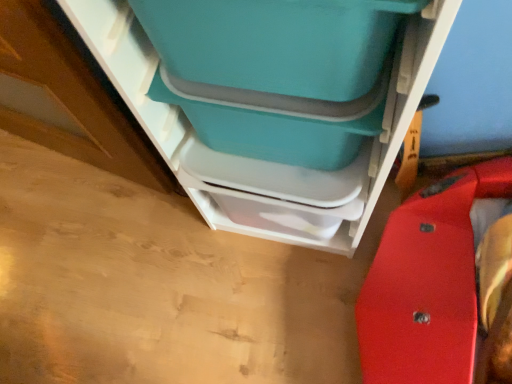
Question: Considering the positions of matte plastic storage container at center and teal plastic storage bin at upper center in the image, is matte plastic storage container at center wider or thinner than teal plastic storage bin at upper center?

Choices:
 (A) wide
 (B) thin

Answer: (B)

Question: From a real-world perspective, is matte plastic storage container at center physically located above or below teal plastic storage bin at upper center?

Choices:
 (A) below
 (B) above

Answer: (B)

Question: Choose the correct answer: Is matte plastic storage container at center inside teal plastic storage bin at upper center or outside it?

Choices:
 (A) outside
 (B) inside

Answer: (B)

Question: Is teal plastic storage bin at upper center bigger or smaller than matte plastic storage container at center?

Choices:
 (A) small
 (B) big

Answer: (B)

Question: Looking at their shapes, would you say teal plastic storage bin at upper center is wider or thinner than matte plastic storage container at center?

Choices:
 (A) thin
 (B) wide

Answer: (B)

Question: From the image's perspective, is teal plastic storage bin at upper center positioned above or below matte plastic storage container at center?

Choices:
 (A) above
 (B) below

Answer: (B)

Question: In the image, is teal plastic storage bin at upper center positioned in front of or behind matte plastic storage container at center?

Choices:
 (A) behind
 (B) front

Answer: (B)